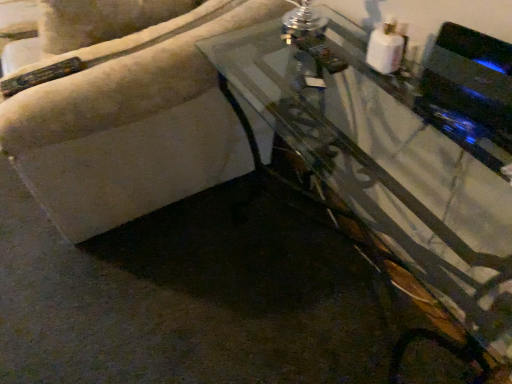
Where is `empty space that is ontop of transparent glass table at center (from a real-world perspective)`? empty space that is ontop of transparent glass table at center (from a real-world perspective) is located at coordinates (379, 120).